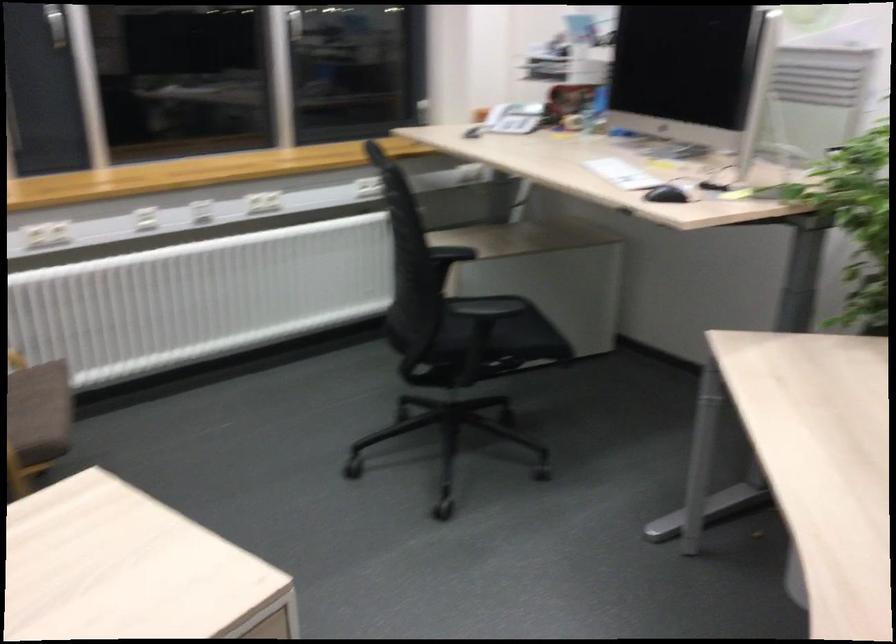
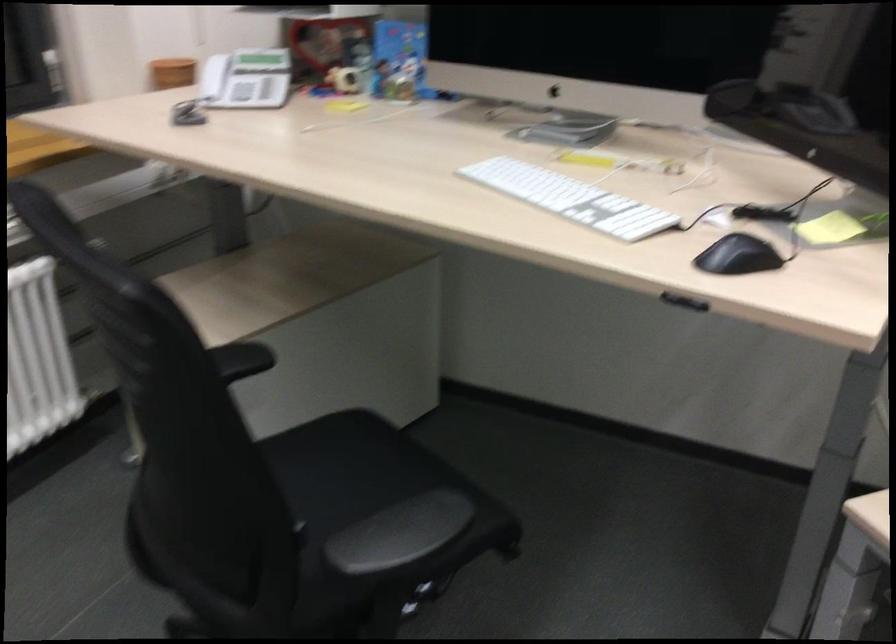
Where in the second image is the point corresponding to point 502,109 from the first image?

(212, 77)